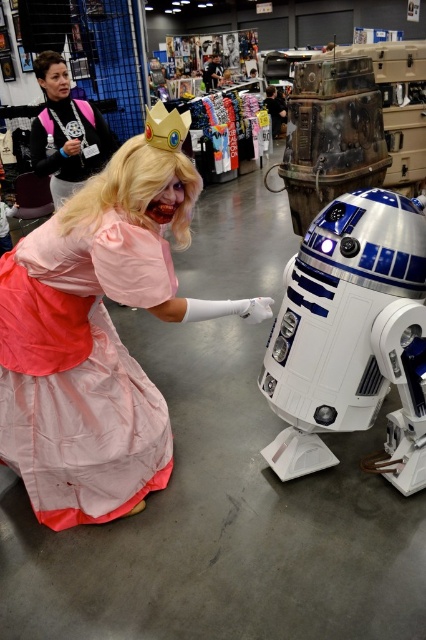
Question: Which point is closer to the camera?

Choices:
 (A) (126, 486)
 (B) (129, 204)

Answer: (B)

Question: In this image, where is blonde synthetic wig at upper left located relative to matte black jacket at upper left?

Choices:
 (A) left
 (B) right

Answer: (B)

Question: Which point is farther to the camera?

Choices:
 (A) (85, 188)
 (B) (77, 280)
 (C) (85, 124)

Answer: (C)

Question: Is pink satin dress at center in front of blonde synthetic wig at upper left?

Choices:
 (A) yes
 (B) no

Answer: (A)

Question: Can you confirm if pink satin dress at center is positioned below matte black jacket at upper left?

Choices:
 (A) yes
 (B) no

Answer: (A)

Question: Which point appears farthest from the camera in this image?

Choices:
 (A) (80, 216)
 (B) (89, 412)
 (C) (57, 180)

Answer: (C)